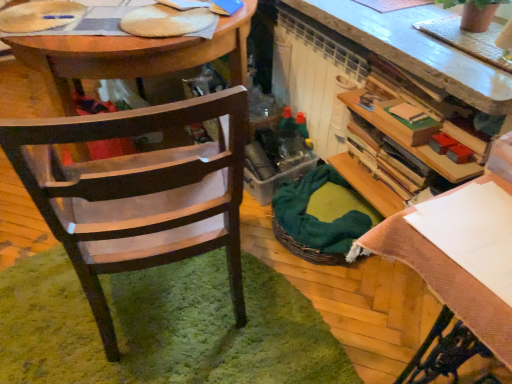
This screenshot has height=384, width=512. In order to click on vacant area that is in front of green woven picnic basket at center in this screenshot , I will do `click(359, 300)`.